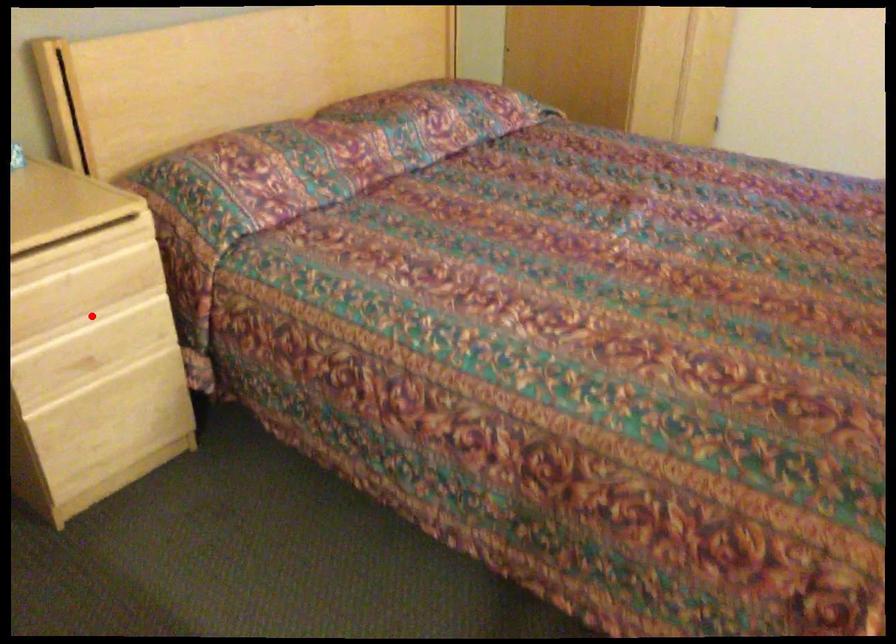
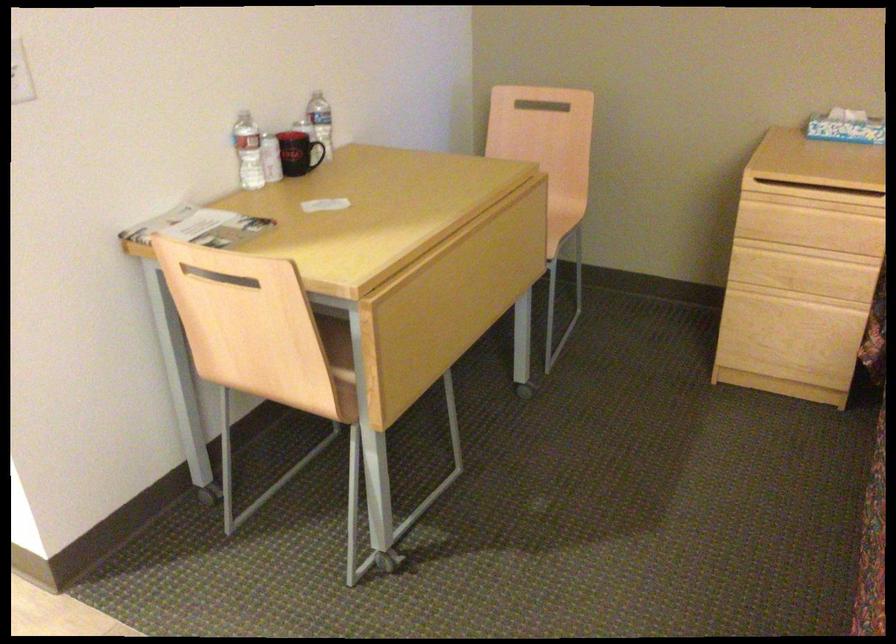
Question: I am providing you with two images of the same scene from different viewpoints. A red point is shown in image1. For the corresponding object point in image2, is it positioned nearer or farther from the camera?

Choices:
 (A) Nearer
 (B) Farther

Answer: (B)